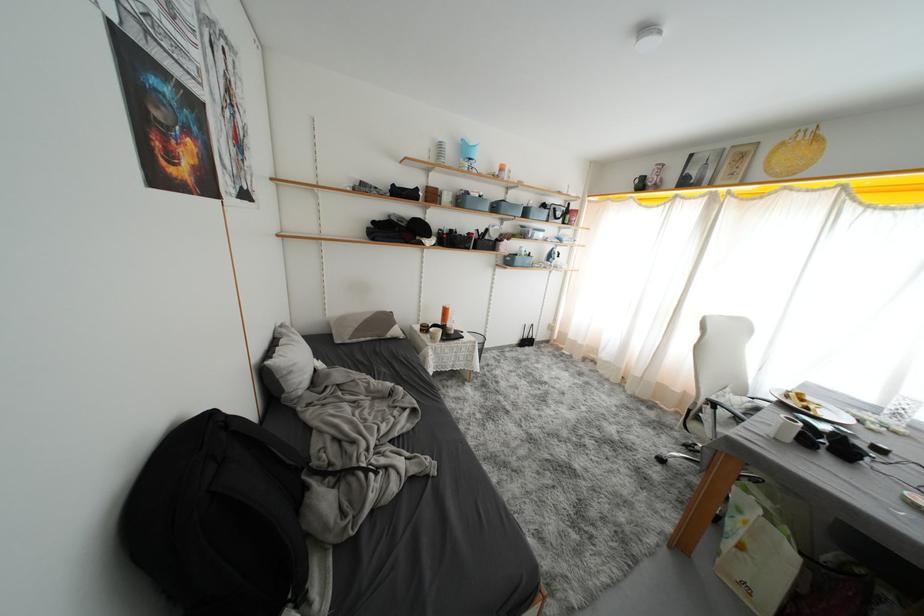
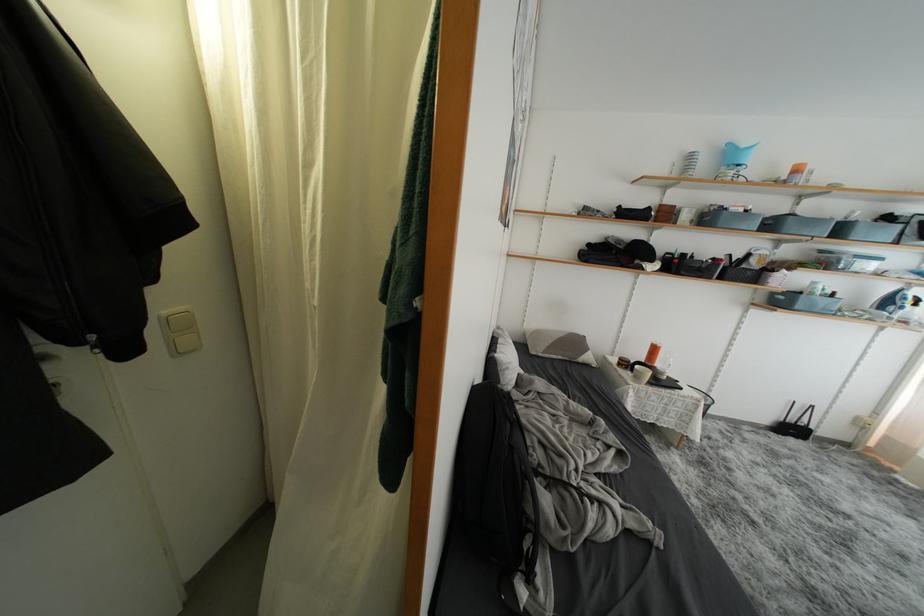
Question: I am providing you with two images of the same scene from different viewpoints. After the viewpoint changes to image2, which objects are now occluded?

Choices:
 (A) white light switch
 (B) white mug handle
 (C) grey storage bin
 (D) none of these

Answer: (D)